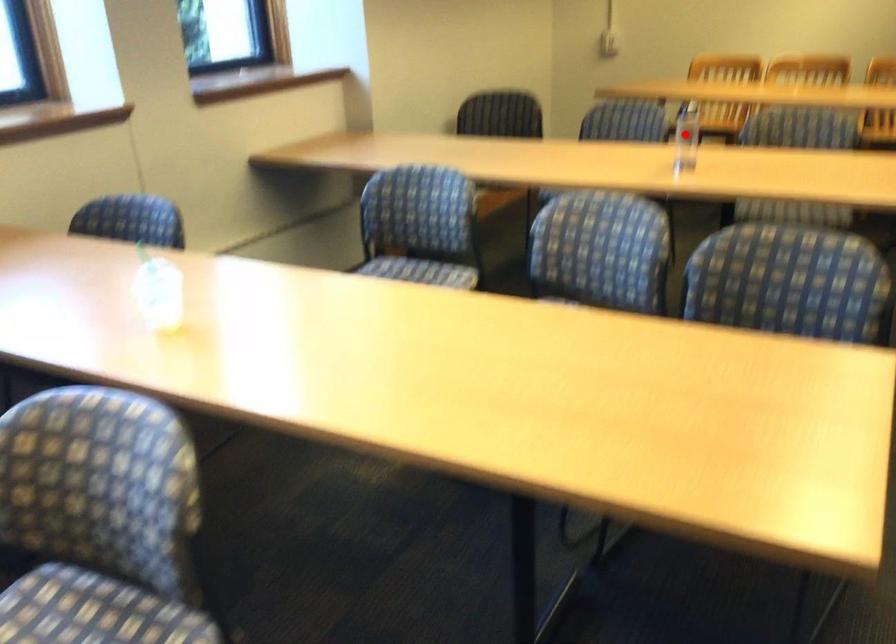
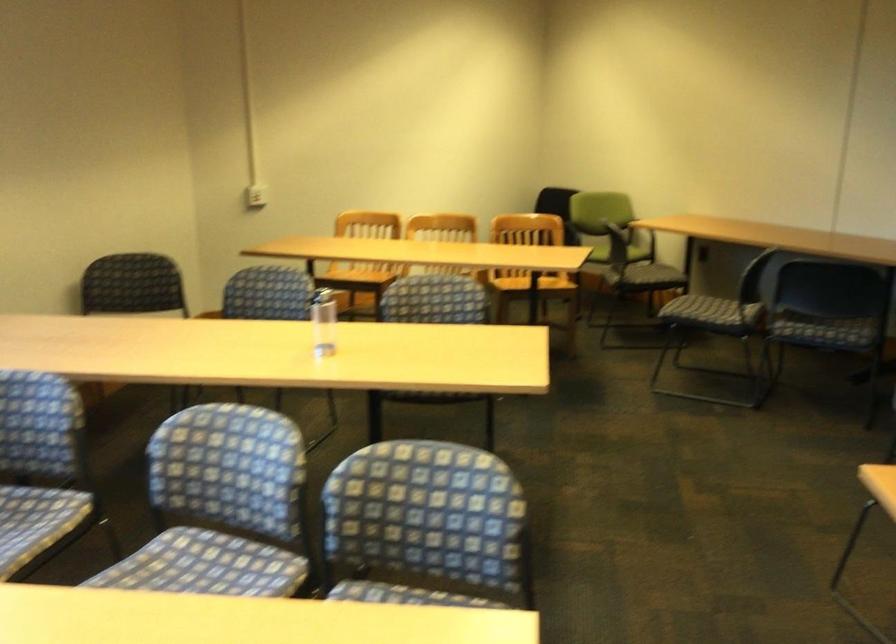
Locate, in the second image, the point that corresponds to the highlighted location in the first image.

(323, 322)